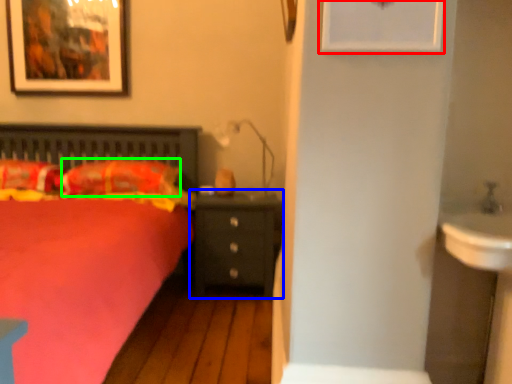
Question: Based on their relative distances, which object is farther from picture frame (highlighted by a red box)? Choose from nightstand (highlighted by a blue box) and pillow (highlighted by a green box).

Choices:
 (A) nightstand
 (B) pillow

Answer: (B)